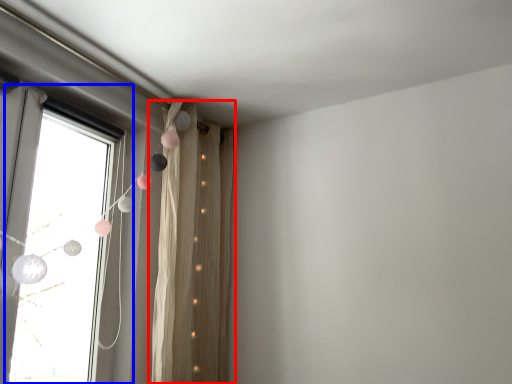
Question: Among these objects, which one is farthest to the camera, curtain (highlighted by a red box) or window (highlighted by a blue box)?

Choices:
 (A) curtain
 (B) window

Answer: (A)